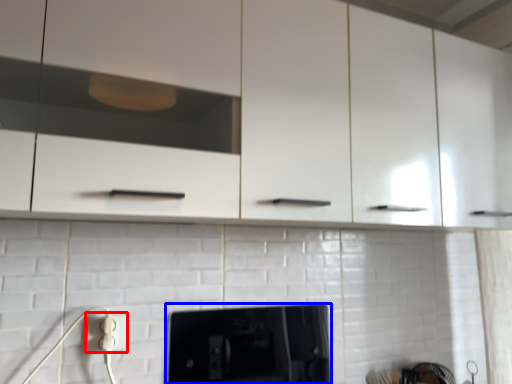
Question: Which point is closer to the camera, electric outlet (highlighted by a red box) or home appliance (highlighted by a blue box)?

Choices:
 (A) electric outlet
 (B) home appliance

Answer: (A)